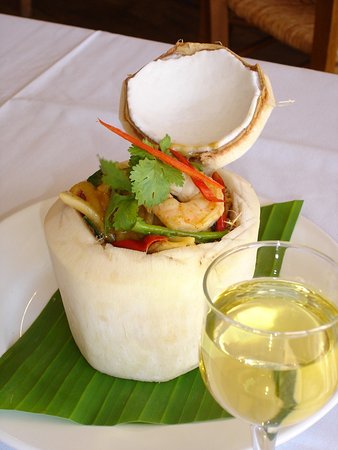
Where is `table`? table is located at coordinates (45, 158).